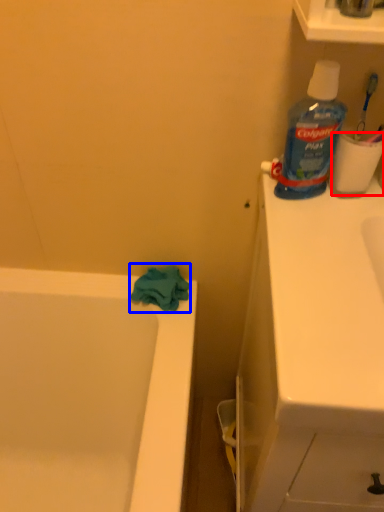
Question: Among these objects, which one is farthest to the camera, toilet paper (highlighted by a red box) or bath towel (highlighted by a blue box)?

Choices:
 (A) toilet paper
 (B) bath towel

Answer: (B)